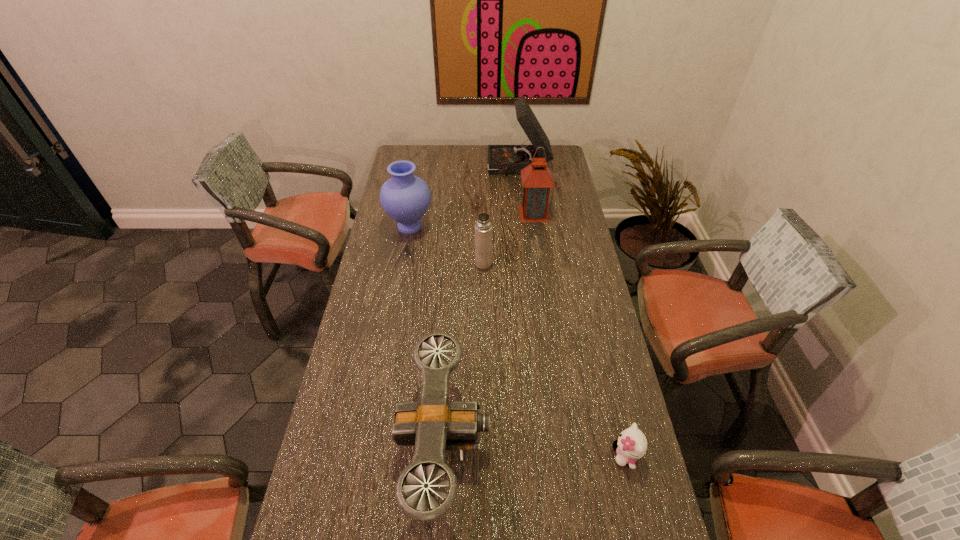
Identify the location of free space between the rightmost object and the phonograph_record. (572, 311).

Locate an element on the screen. free spot between the shortest object and the vase is located at coordinates (517, 341).

Locate an element on the screen. object that is the nearest to the rightmost object is located at coordinates (433, 424).

Identify which object is the third nearest to the third shortest object. Please provide its 2D coordinates. Your answer should be formatted as a tuple, i.e. [(x, y)], where the tuple contains the x and y coordinates of a point satisfying the conditions above.

[(433, 424)]

Image resolution: width=960 pixels, height=540 pixels. I want to click on vacant point that satisfies the following two spatial constraints: 1. on the front side of the thermos bottle; 2. on the right side of the vase, so click(403, 264).